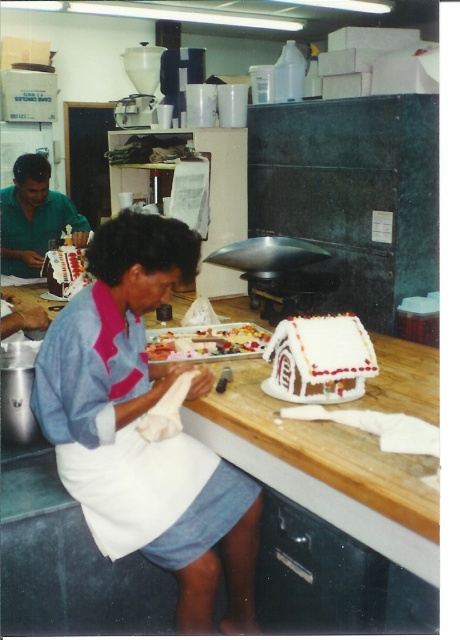
Which is above, wooden at center or glazed sugar cookies at center?

glazed sugar cookies at center is higher up.

Does wooden at center have a greater height compared to glazed sugar cookies at center?

Yes.

Is point (424, 467) positioned before point (187, 326)?

Yes, point (424, 467) is closer to viewer.

In order to click on wooden at center in this screenshot , I will do `click(325, 468)`.

Between blue fabric shirt at center and wooden at center, which one has less height?

wooden at center

Between blue fabric shirt at center and wooden at center, which one is positioned higher?

wooden at center

Is point (210, 477) closer to camera compared to point (379, 458)?

No, (210, 477) is further to viewer.

The width and height of the screenshot is (460, 640). Identify the location of blue fabric shirt at center. (134, 426).

Does blue fabric shirt at center have a greater width compared to white frosted gingerbread house at center?

Indeed, blue fabric shirt at center has a greater width compared to white frosted gingerbread house at center.

Between blue fabric shirt at center and white frosted gingerbread house at center, which one has less height?

white frosted gingerbread house at center is shorter.

You are a GUI agent. You are given a task and a screenshot of the screen. Output one action in this format:
    pyautogui.click(x=<x>, y=<y>)
    Task: Click on the blue fabric shirt at center
    
    Given the screenshot: What is the action you would take?
    pyautogui.click(x=134, y=426)